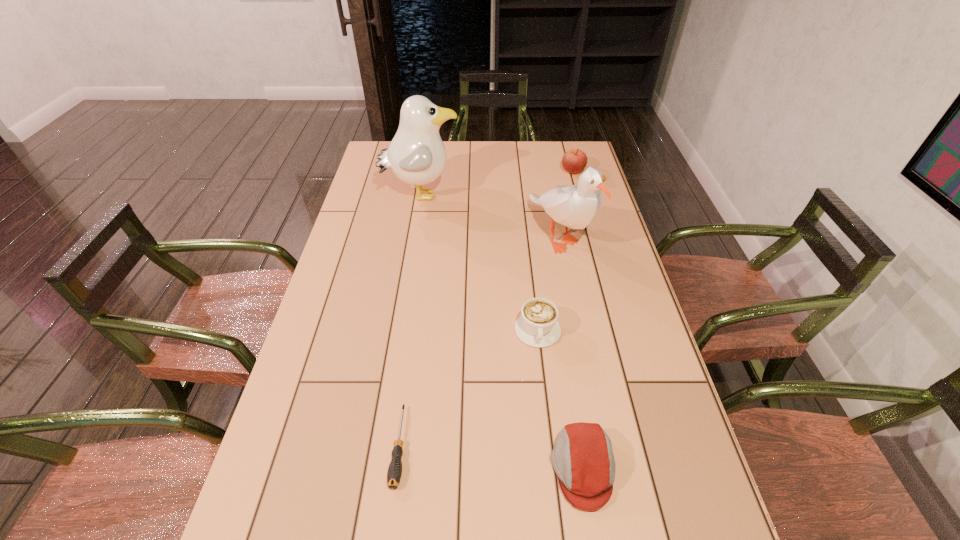
The image size is (960, 540). In order to click on the left gull in this screenshot , I will do `click(416, 155)`.

The image size is (960, 540). I want to click on the right gull, so click(x=574, y=206).

Image resolution: width=960 pixels, height=540 pixels. In order to click on the second tallest object in this screenshot , I will do `click(574, 206)`.

At what (x,y) coordinates should I click in order to perform the action: click on apple. Please return your answer as a coordinate pair (x, y). Looking at the image, I should click on (574, 161).

In order to click on the third tallest object in this screenshot , I will do `click(574, 161)`.

Where is `cap`? Image resolution: width=960 pixels, height=540 pixels. cap is located at coordinates (582, 457).

Where is `cappuccino`? cappuccino is located at coordinates (537, 326).

I want to click on the shortest object, so click(x=394, y=473).

You are a GUI agent. You are given a task and a screenshot of the screen. Output one action in this format:
    pyautogui.click(x=<x>, y=<y>)
    Task: Click on the vacant space situated 0.060m on the beak of the left gull
    The width and height of the screenshot is (960, 540).
    Given the screenshot: What is the action you would take?
    pyautogui.click(x=477, y=195)

I want to click on free space located at the beak of the shorter gull, so click(x=570, y=291).